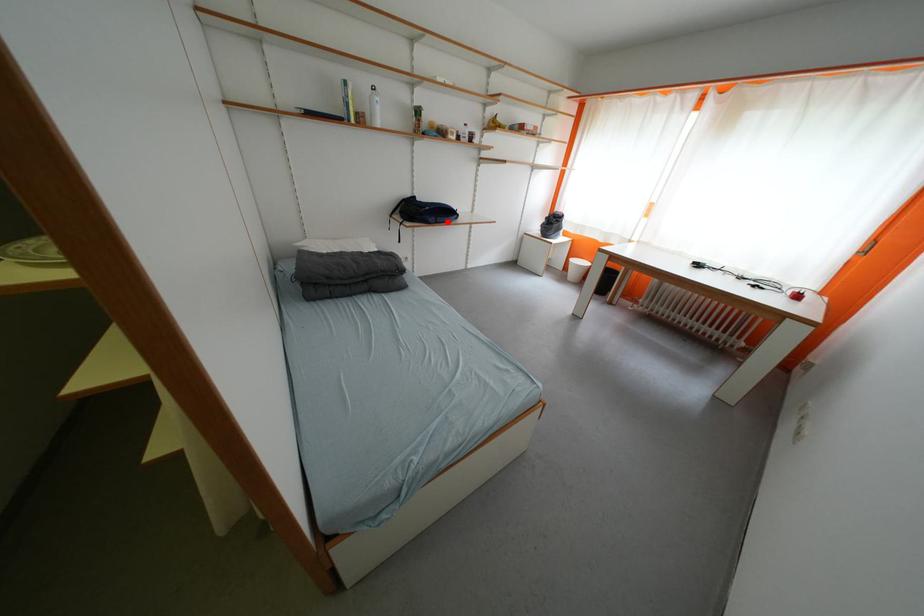
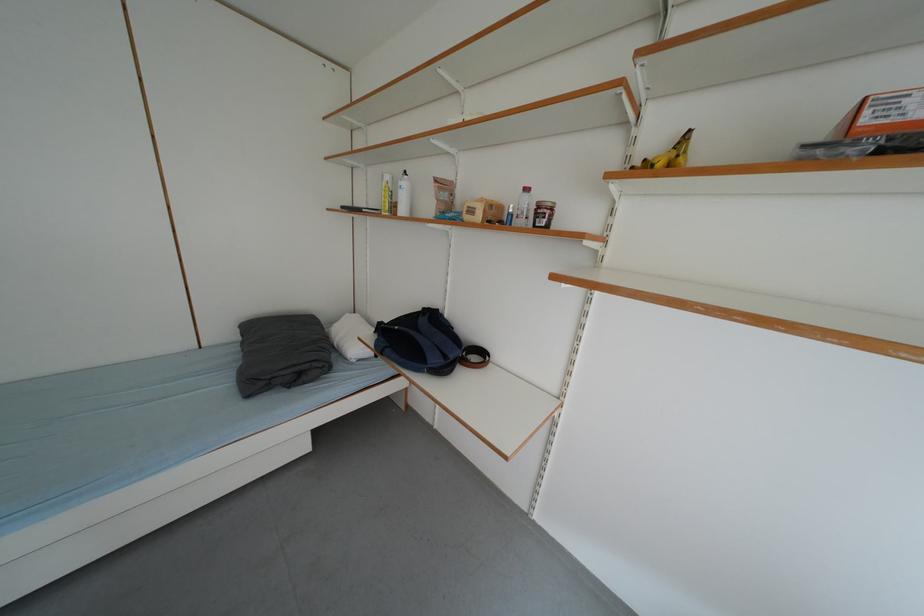
Question: I am providing you with two images of the same scene from different viewpoints. In image1, a red point is highlighted. Considering the same 3D point in image2, which of the following is correct?

Choices:
 (A) It is closer
 (B) It is farther

Answer: (B)